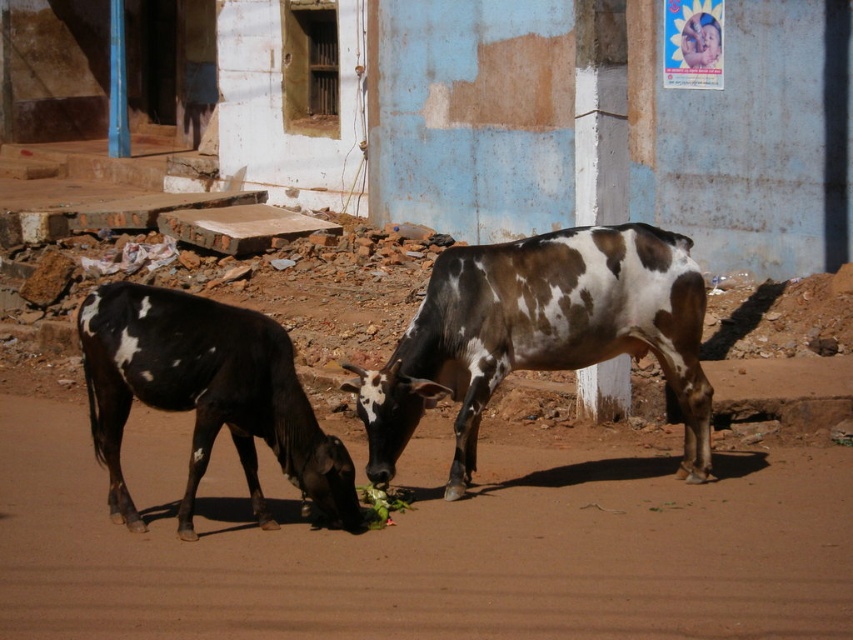
Based on the photo, who is more forward, (173, 461) or (328, 464)?

Point (328, 464) is in front.

Which is above, brown dirt track at center or black and white spotted cow at left?

black and white spotted cow at left is above.

Identify the location of brown dirt track at center. The height and width of the screenshot is (640, 853). (425, 544).

Does brown dirt track at center appear on the left side of brown spotted cow at center?

Result: Indeed, brown dirt track at center is positioned on the left side of brown spotted cow at center.

Can you confirm if brown dirt track at center is taller than brown spotted cow at center?

No.

What do you see at coordinates (425, 544) in the screenshot? Image resolution: width=853 pixels, height=640 pixels. I see `brown dirt track at center` at bounding box center [425, 544].

Identify the location of brown dirt track at center. (425, 544).

Can you confirm if brown spotted cow at center is positioned to the left of black and white spotted cow at left?

No, brown spotted cow at center is not to the left of black and white spotted cow at left.

Is brown spotted cow at center thinner than black and white spotted cow at left?

Incorrect, brown spotted cow at center's width is not less than black and white spotted cow at left's.

What do you see at coordinates (538, 333) in the screenshot?
I see `brown spotted cow at center` at bounding box center [538, 333].

Find the location of a particular element. Image resolution: width=853 pixels, height=640 pixels. brown spotted cow at center is located at coordinates (538, 333).